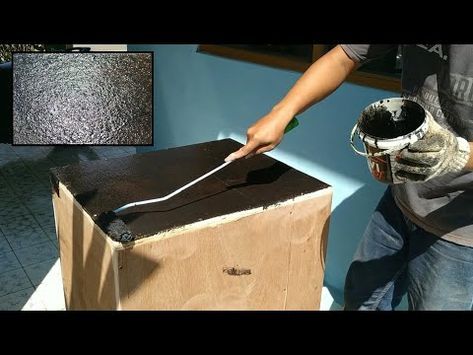
You are a GUI agent. You are given a task and a screenshot of the screen. Output one action in this format:
    pyautogui.click(x=<x>, y=<y>)
    Task: Click on the space behind table
    The height and width of the screenshot is (355, 473).
    Given the screenshot: What is the action you would take?
    pyautogui.click(x=341, y=224)